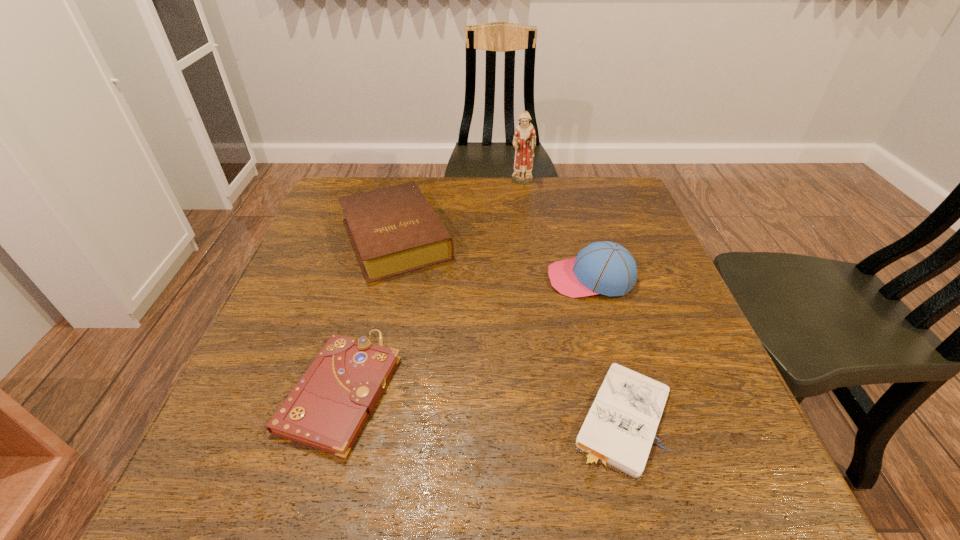
You are a GUI agent. You are given a task and a screenshot of the screen. Output one action in this format:
    pyautogui.click(x=<x>, y=<y>)
    Task: Click on the farthest object
    The width and height of the screenshot is (960, 540).
    Given the screenshot: What is the action you would take?
    coord(524,141)

Find the location of a particular element. The width and height of the screenshot is (960, 540). the tallest object is located at coordinates (524, 141).

You are a GUI agent. You are given a task and a screenshot of the screen. Output one action in this format:
    pyautogui.click(x=<x>, y=<y>)
    Task: Click on the baseball cap
    
    Given the screenshot: What is the action you would take?
    pyautogui.click(x=603, y=267)

The image size is (960, 540). What are the coordinates of `Bible` in the screenshot? It's located at (394, 230).

The width and height of the screenshot is (960, 540). Find the location of `the left notebook`. the left notebook is located at coordinates (326, 410).

You are a GUI agent. You are given a task and a screenshot of the screen. Output one action in this format:
    pyautogui.click(x=<x>, y=<y>)
    Task: Click on the fourth tallest object
    This screenshot has width=960, height=540.
    Given the screenshot: What is the action you would take?
    pyautogui.click(x=326, y=410)

Locate an element on the screen. The image size is (960, 540). the shortest object is located at coordinates (619, 430).

Locate an element on the screen. This screenshot has height=540, width=960. the right notebook is located at coordinates (619, 430).

Where is `vacant region located 0.310m on the front-facing side of the farthest object`? vacant region located 0.310m on the front-facing side of the farthest object is located at coordinates click(532, 254).

Locate an element on the screen. This screenshot has width=960, height=540. vacant area situated 0.210m on the front-facing side of the second tallest object is located at coordinates (457, 279).